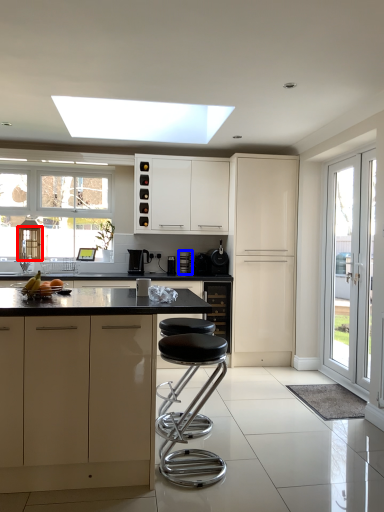
Question: Among these objects, which one is farthest to the camera, door (highlighted by a red box) or appliance (highlighted by a blue box)?

Choices:
 (A) door
 (B) appliance

Answer: (B)